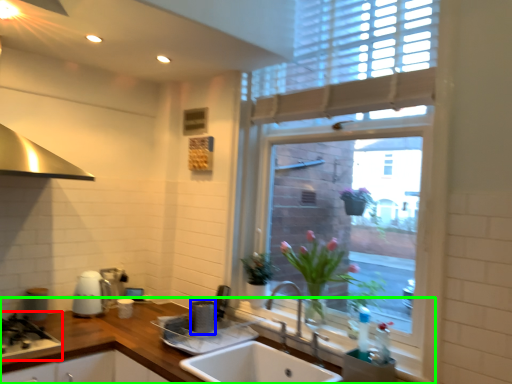
Question: Based on their relative distances, which object is nearer to gas stove (highlighted by a red box)? Choose from appliance (highlighted by a blue box) and countertop (highlighted by a green box).

Choices:
 (A) appliance
 (B) countertop

Answer: (B)